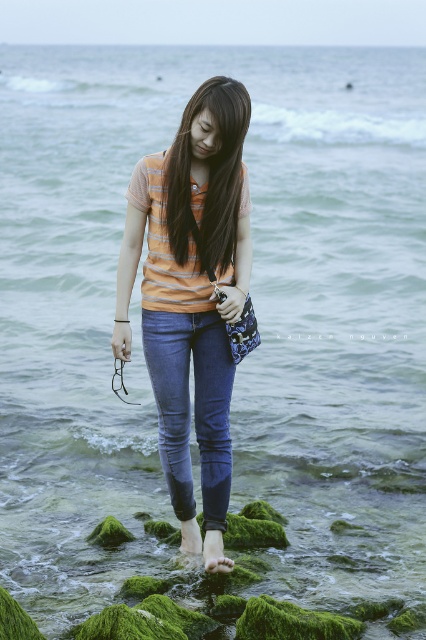
Question: Which point is closer to the camera?

Choices:
 (A) (227, 141)
 (B) (203, 108)
 (C) (206, 516)

Answer: (B)

Question: Is denim jeans at center positioned at the back of matte orange shirt at center?

Choices:
 (A) no
 (B) yes

Answer: (B)

Question: Is matte orange t-shirt at center to the right of denim jeans at center from the viewer's perspective?

Choices:
 (A) no
 (B) yes

Answer: (A)

Question: From the image, what is the correct spatial relationship of denim jeans at center in relation to matte orange shirt at center?

Choices:
 (A) below
 (B) above

Answer: (A)

Question: Which object appears closest to the camera in this image?

Choices:
 (A) denim jeans at center
 (B) matte orange shirt at center

Answer: (B)

Question: Considering the real-world distances, which object is farthest from the matte orange shirt at center?

Choices:
 (A) matte orange t-shirt at center
 (B) denim jeans at center

Answer: (B)